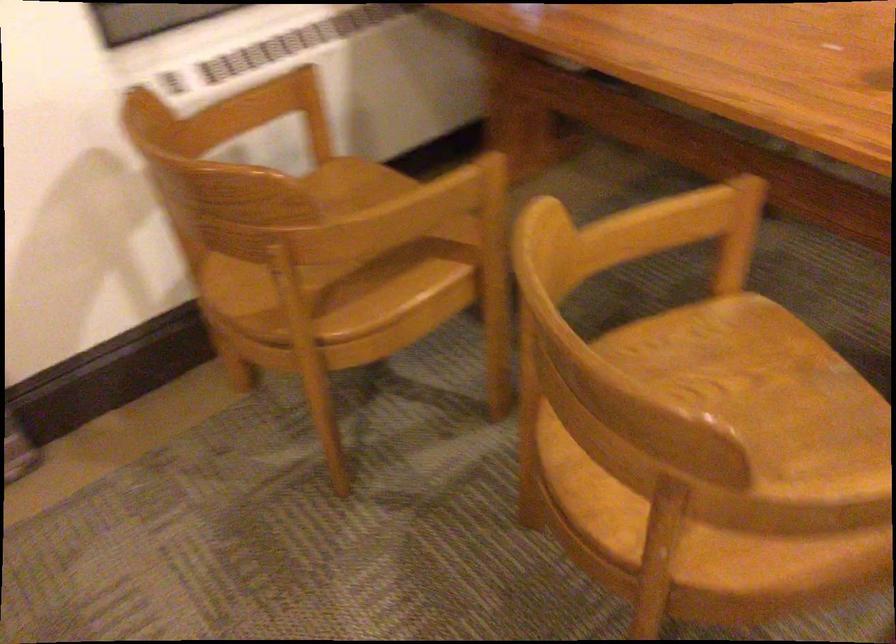
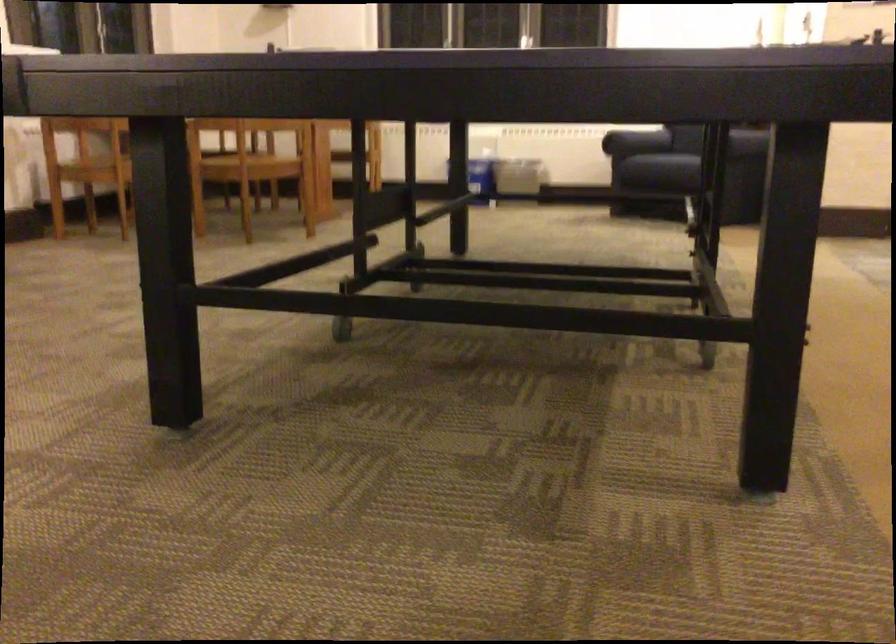
Where in the second image is the point corresponding to (x=707, y=542) from the first image?

(248, 160)